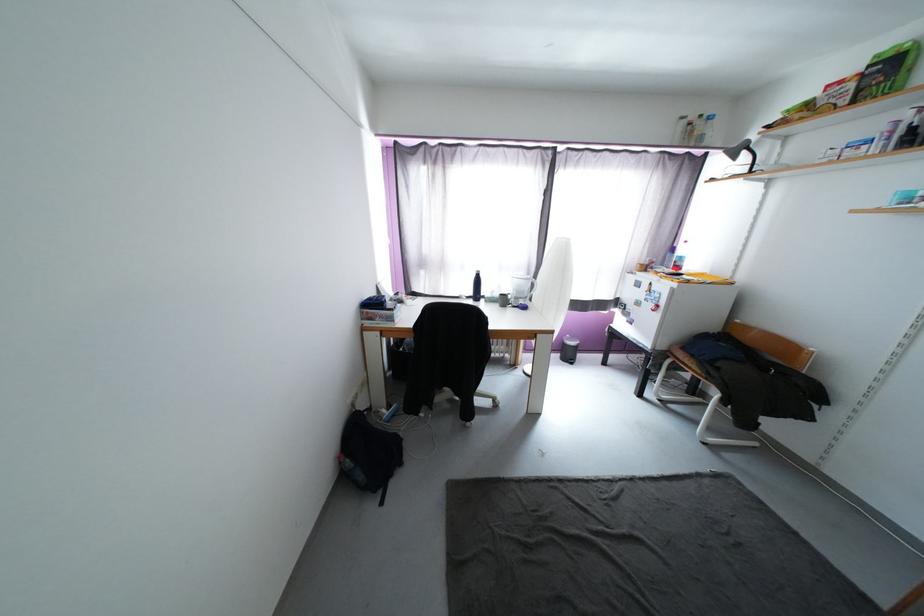
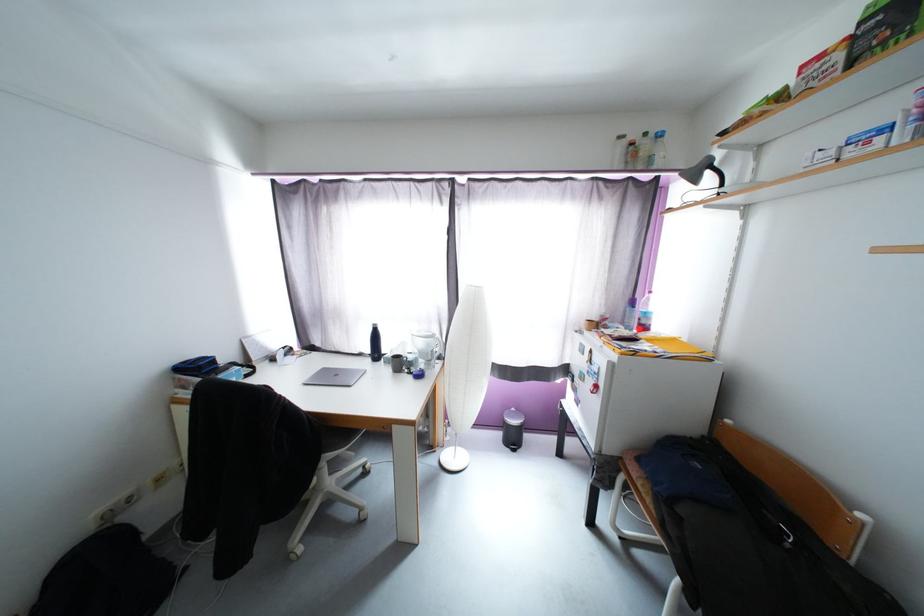
Where in the second image is the point corresponding to the point at 687,260 from the first image?

(651, 315)